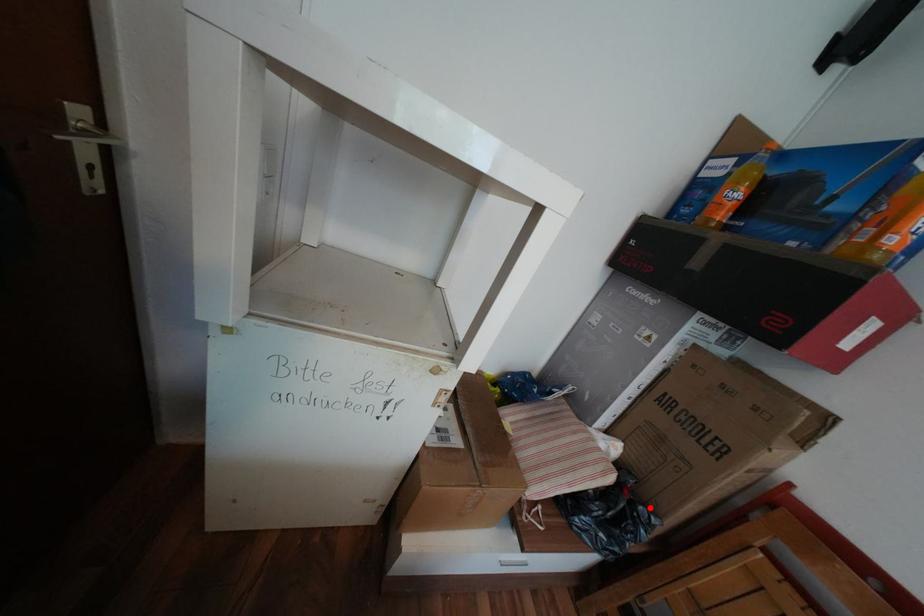
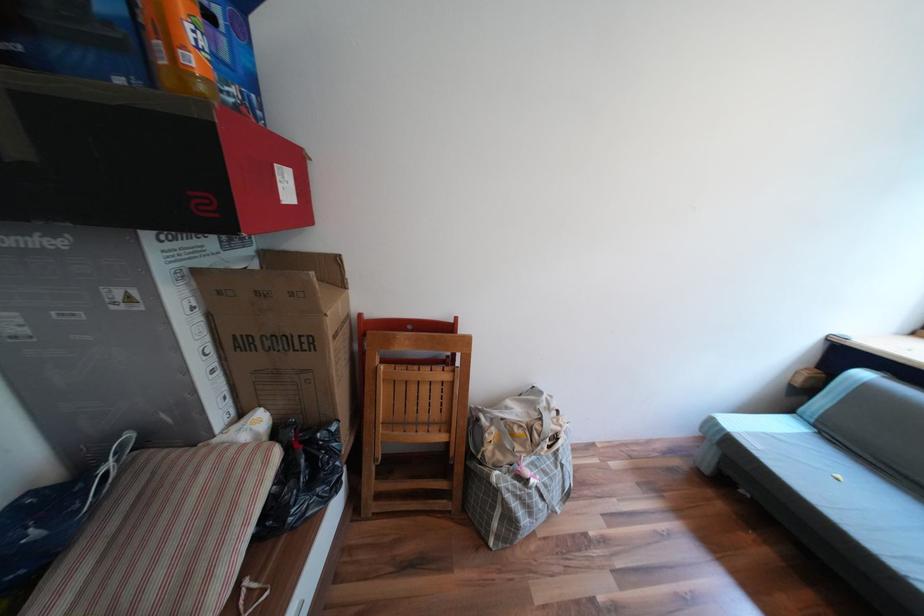
In the second image, find the point that corresponds to the highlighted location in the first image.

(327, 435)